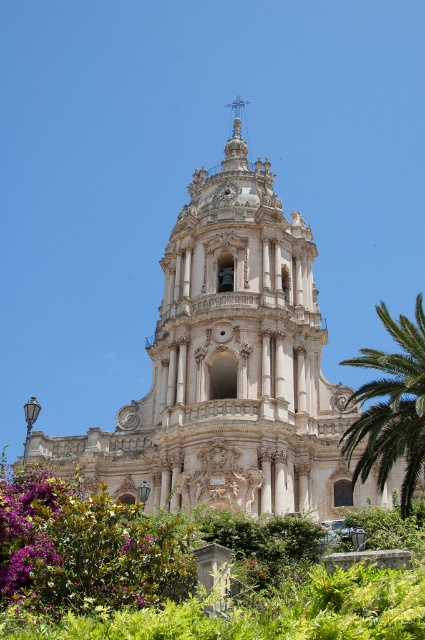
Question: Which of the following is the farthest from the observer?

Choices:
 (A) (382, 456)
 (B) (227, 458)

Answer: (B)

Question: Does white stone church at center appear over green leafy palm at right?

Choices:
 (A) yes
 (B) no

Answer: (A)

Question: Can you confirm if white stone church at center is positioned to the right of green leafy palm at right?

Choices:
 (A) no
 (B) yes

Answer: (A)

Question: Which object appears closest to the camera in this image?

Choices:
 (A) green leafy palm at right
 (B) white stone church at center

Answer: (A)

Question: Can you confirm if white stone church at center is positioned to the left of green leafy palm at right?

Choices:
 (A) yes
 (B) no

Answer: (A)

Question: Which object appears farthest from the camera in this image?

Choices:
 (A) green leafy palm at right
 (B) white stone church at center

Answer: (B)